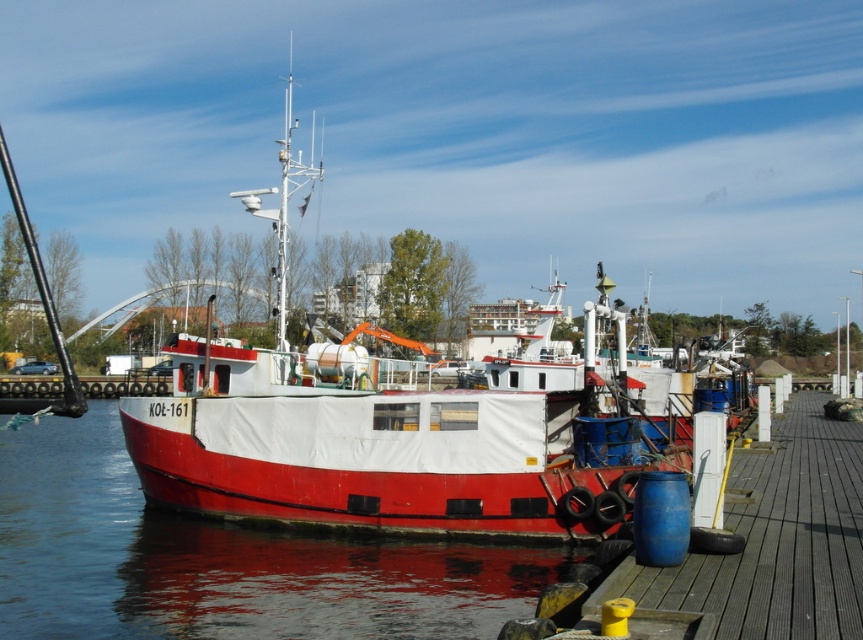
You are standing on the wooden dock at center and want to step onto the red matte water at center. Is this possible?

No, you cannot step onto the red matte water at center because water is a liquid surface and cannot support your weight.

You are a marine biologist who needs to board the red matte boat at center to collect water samples from the red matte water at center. The boat has a ladder that can extend down to the water. What is the minimum length the ladder needs to be to reach the water from the boat?

The ladder needs to be at least 13.72 meters long to reach from the red matte boat at center to the red matte water at center.